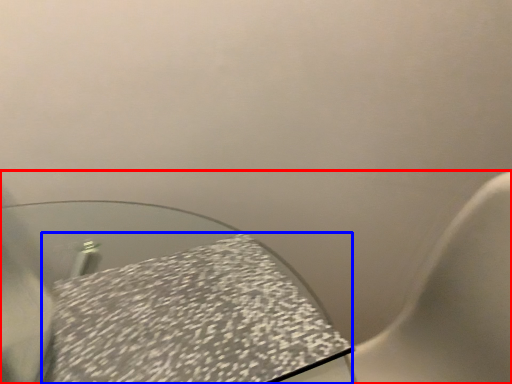
Question: Which of the following is the closest to the observer, toilet (highlighted by a red box) or tablecloth (highlighted by a blue box)?

Choices:
 (A) toilet
 (B) tablecloth

Answer: (A)